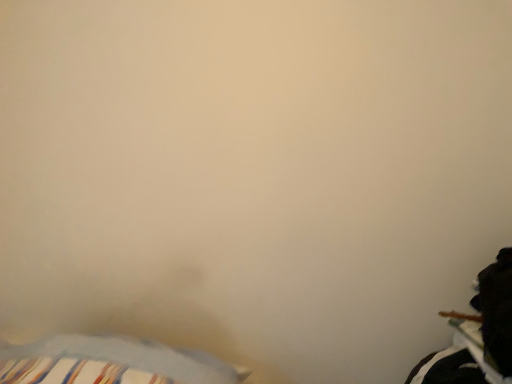
This screenshot has width=512, height=384. What do you see at coordinates (478, 335) in the screenshot?
I see `black fabric at right` at bounding box center [478, 335].

I want to click on black fabric at right, so click(x=478, y=335).

The width and height of the screenshot is (512, 384). I want to click on black fabric at right, so click(x=478, y=335).